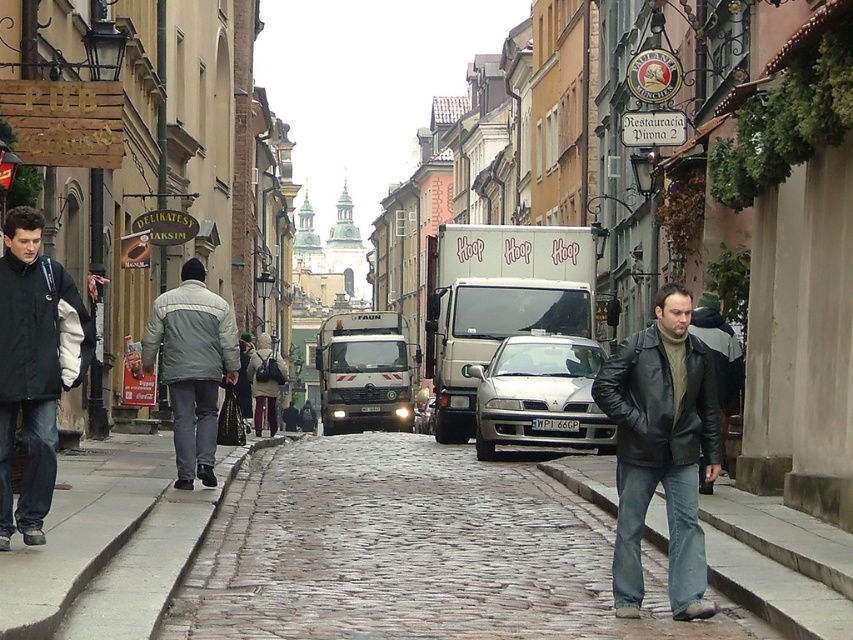
Is point (200, 394) less distant than point (728, 369)?

Yes.

Who is higher up, gray fleece jacket at left or leather jacket at right?

Positioned higher is leather jacket at right.

The height and width of the screenshot is (640, 853). What do you see at coordinates (192, 365) in the screenshot?
I see `gray fleece jacket at left` at bounding box center [192, 365].

Where is `gray fleece jacket at left`? gray fleece jacket at left is located at coordinates (192, 365).

Is cobblestone pavement at center positioned at the back of silver metallic sedan at center?

No.

Locate an element on the screen. This screenshot has height=640, width=853. cobblestone pavement at center is located at coordinates (413, 552).

Does cobblestone pavement at center appear over dark gray jacket at left?

No, cobblestone pavement at center is not above dark gray jacket at left.

Where is `cobblestone pavement at center`? cobblestone pavement at center is located at coordinates (413, 552).